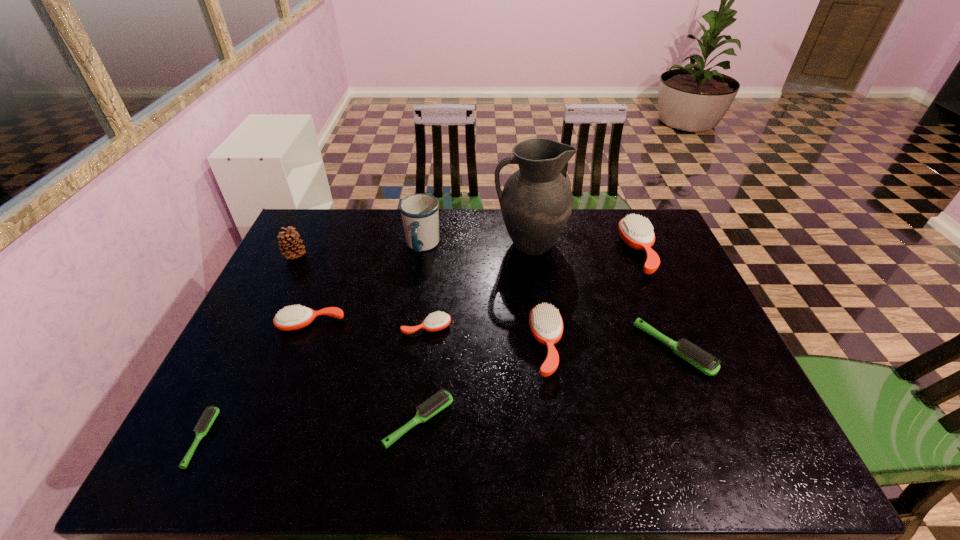
This screenshot has height=540, width=960. What are the coordinates of `pitcher` in the screenshot? It's located at (536, 202).

Where is `mug`? This screenshot has width=960, height=540. mug is located at coordinates (420, 212).

Locate an element on the screen. the second tallest object is located at coordinates (420, 212).

You are a GUI agent. You are given a task and a screenshot of the screen. Output one action in this format:
    pyautogui.click(x=<x>, y=<y>)
    Task: Click on the third tallest object
    The height and width of the screenshot is (540, 960).
    Given the screenshot: What is the action you would take?
    pyautogui.click(x=288, y=243)

Where is `the tallest hairbrush`? the tallest hairbrush is located at coordinates (637, 232).

This screenshot has height=540, width=960. Find the location of `the fourth tallest object`. the fourth tallest object is located at coordinates (637, 232).

Image resolution: width=960 pixels, height=540 pixels. I want to click on the fifth hairbrush from left to right, so click(546, 324).

Find the location of a particular element. the third smallest orange hairbrush is located at coordinates click(546, 324).

Locate an element on the screen. The image size is (960, 540). the sixth tallest object is located at coordinates (296, 317).

Locate an element on the screen. The width and height of the screenshot is (960, 540). the third tallest hairbrush is located at coordinates (296, 317).